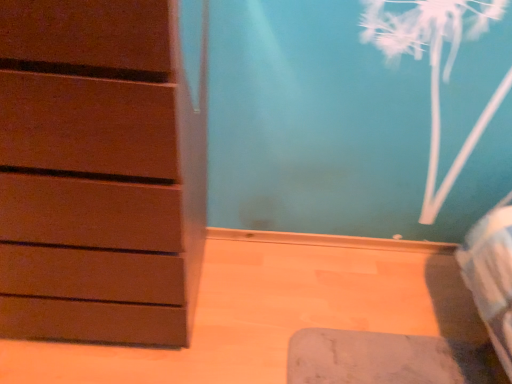
You are a GUI agent. You are given a task and a screenshot of the screen. Output one action in this format:
    pyautogui.click(x=<x>, y=<y>)
    Task: Click on the vacant area located to the right-hand side of matte brown chest of drawers at left
    This screenshot has height=384, width=512.
    Given the screenshot: What is the action you would take?
    pyautogui.click(x=266, y=306)